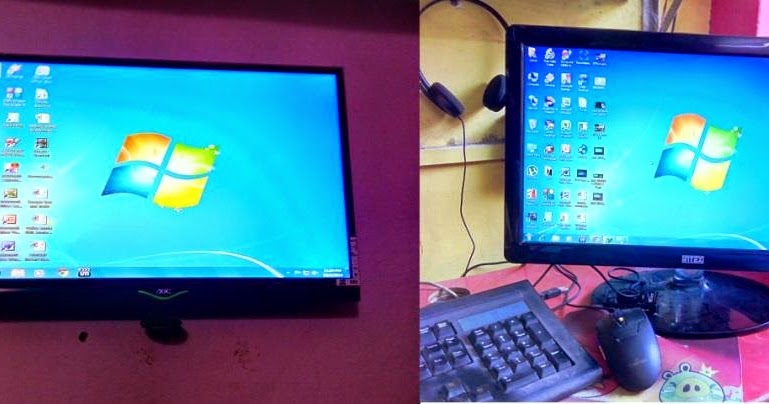
What are the coordinates of `screen frame` in the screenshot? It's located at (231, 302), (285, 64), (626, 35), (573, 254).